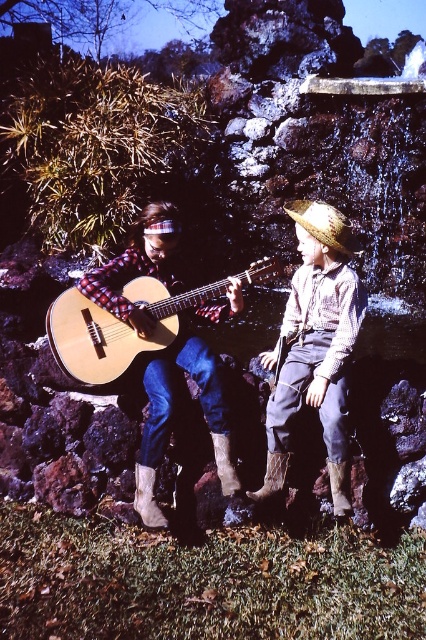
Question: Which of the following is the closest to the observer?

Choices:
 (A) (285, 209)
 (B) (221, 456)
 (C) (213, 308)
 (D) (141, 476)

Answer: (D)

Question: Is the position of strawmaterial/texturehat at upper center less distant than that of brown suede cowboy boot at lower left?

Choices:
 (A) yes
 (B) no

Answer: (B)

Question: Is light brown acoustic guitar at center to the left of brown suede cowboy boot at lower center from the viewer's perspective?

Choices:
 (A) no
 (B) yes

Answer: (B)

Question: Does light brown acoustic guitar at center have a smaller size compared to brown suede cowboy boot at lower center?

Choices:
 (A) yes
 (B) no

Answer: (B)

Question: Which is farther from the strawmaterial/texturehat at upper center?

Choices:
 (A) matte plaid shirt at left
 (B) brown suede cowboy boot at lower left
 (C) brown woven leather cowboy boot at lower center

Answer: (B)

Question: Which object is farther from the camera taking this photo?

Choices:
 (A) brown suede cowboy boot at lower center
 (B) brown suede cowboy boot at lower left

Answer: (A)